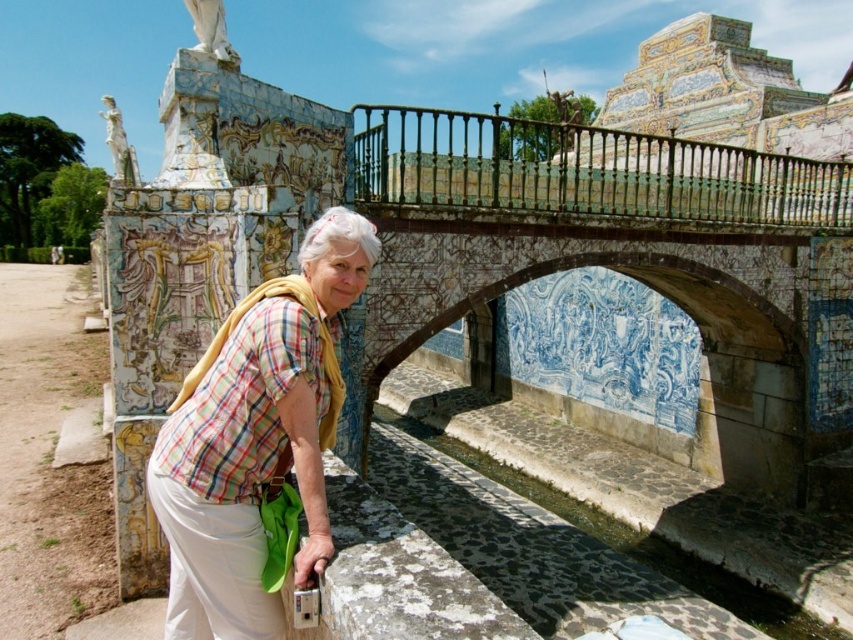
Question: Which point is farther to the camera?

Choices:
 (A) (265, 458)
 (B) (109, 150)
 (C) (177, 588)
 (D) (791, 397)

Answer: (B)

Question: From the image, what is the correct spatial relationship of blue painted stone bridge at center in relation to green patina metal railing at upper center?

Choices:
 (A) below
 (B) above

Answer: (A)

Question: Does green patina metal railing at upper center come behind white marble statue at upper left?

Choices:
 (A) no
 (B) yes

Answer: (A)

Question: Does green patina metal railing at upper center come in front of white marble statue at upper center?

Choices:
 (A) yes
 (B) no

Answer: (B)

Question: Among these objects, which one is nearest to the camera?

Choices:
 (A) green patina metal railing at upper center
 (B) white marble statue at upper left

Answer: (A)

Question: Which object is the closest to the plaid fabric at center?

Choices:
 (A) white marble statue at upper left
 (B) white marble statue at upper center

Answer: (B)